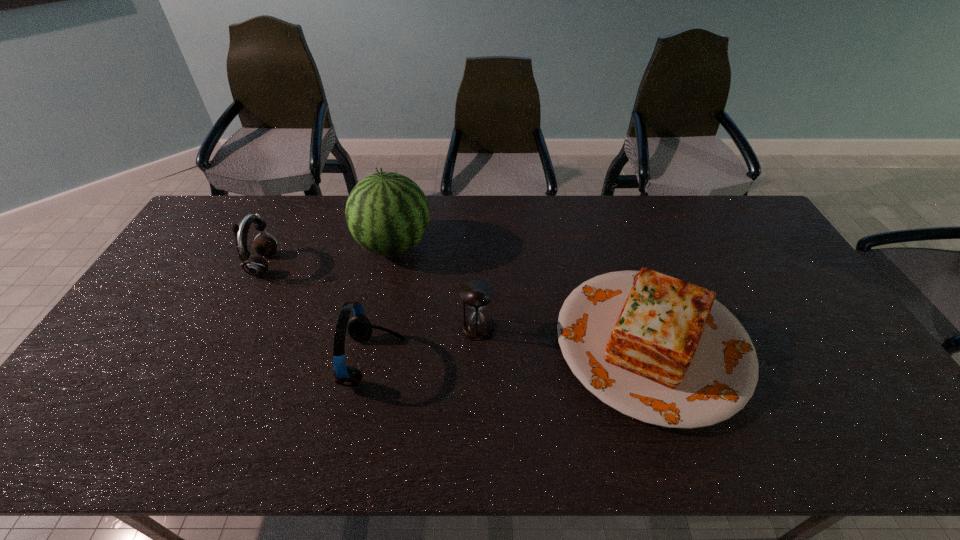
The height and width of the screenshot is (540, 960). In order to click on watermelon in this screenshot , I will do `click(387, 213)`.

Where is `earphone`? The image size is (960, 540). earphone is located at coordinates (254, 265).

You are a GUI agent. You are given a task and a screenshot of the screen. Output one action in this format:
    pyautogui.click(x=<x>, y=<y>)
    Task: Click on the headset
    The width and height of the screenshot is (960, 540).
    Given the screenshot: What is the action you would take?
    pyautogui.click(x=359, y=328)

Locate an element on the screen. The image size is (960, 540). the second object from right to left is located at coordinates [x=476, y=294].

You are a GUI agent. You are given a task and a screenshot of the screen. Output one action in this format:
    pyautogui.click(x=<x>, y=<y>)
    Task: Click on the lasagna
    The image size is (960, 540).
    Given the screenshot: What is the action you would take?
    pyautogui.click(x=661, y=350)

The width and height of the screenshot is (960, 540). Identify the location of vacant space located 0.210m on the left of the tallest object. (293, 245).

This screenshot has height=540, width=960. Identify the location of vacant space located 0.250m on the ear pads of the leftmost object. (353, 266).

At what (x,y) coordinates should I click in order to perform the action: click on free spot located 0.340m with the microphone attached to the side of the headset. Please return your answer as a coordinate pair (x, y). The height and width of the screenshot is (540, 960). Looking at the image, I should click on (531, 361).

Where is `vacant space situated on the back of the hourglass`? This screenshot has height=540, width=960. vacant space situated on the back of the hourglass is located at coordinates (x=477, y=295).

Locate an element on the screen. This screenshot has height=540, width=960. vacant space located 0.340m on the left of the lasagna is located at coordinates (432, 343).